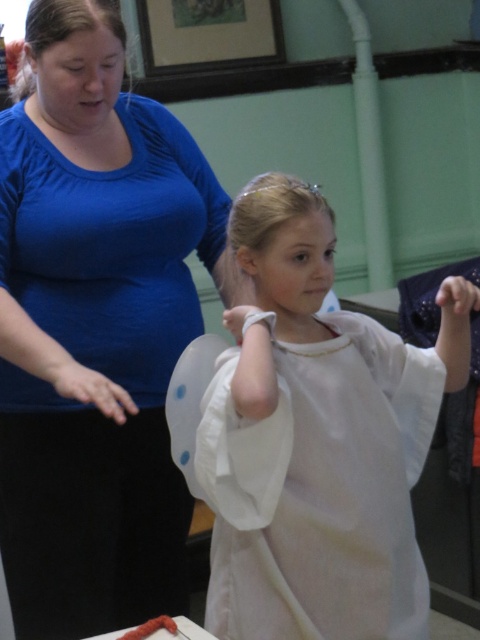
You are standing at the origin point in the image. There are two points marked in the image. Which of the two points, point (91, 160) or point (300, 408), is located behind the other?

Point (91, 160) is behind point (300, 408).

In the scene shown: You are a photographer setting up for a group photo. You need to position the blue matte shirt at upper left and the white cotton dress at center so that both are clearly visible. Based on their current positions, which object is blocking the view of the other?

The blue matte shirt at upper left is blocking the view of the white cotton dress at center because the white cotton dress at center is behind the blue matte shirt at upper left.

You are an interior designer assessing the spatial arrangement of the room. The blue matte shirt at upper left and the white cotton dress at center are part of the scene. Which of these two items has a smaller horizontal space occupied?

The blue matte shirt at upper left has a lesser width compared to the white cotton dress at center, so the blue matte shirt at upper left occupies a smaller horizontal space.